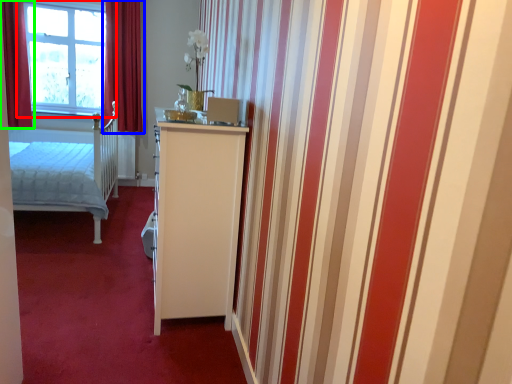
Question: Which object is positioned farthest from window (highlighted by a red box)? Select from curtain (highlighted by a blue box) and curtain (highlighted by a green box).

Choices:
 (A) curtain
 (B) curtain

Answer: (B)